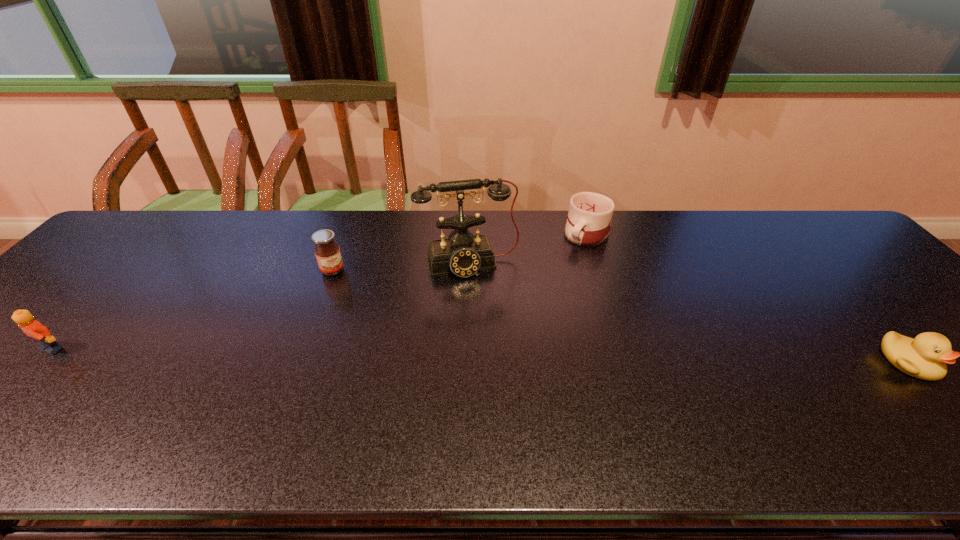
This screenshot has width=960, height=540. I want to click on free space on the desktop that is between the leftmost object and the duckling and is positioned on the dial of the tallest object, so [x=494, y=356].

At what (x,y) coordinates should I click in order to perform the action: click on free space on the desktop that is between the leftmost object and the rightmost object and is positioned on the label side of the jam. Please return your answer as a coordinate pair (x, y). The width and height of the screenshot is (960, 540). Looking at the image, I should click on (396, 354).

You are a GUI agent. You are given a task and a screenshot of the screen. Output one action in this format:
    pyautogui.click(x=<x>, y=<y>)
    Task: Click on the vacant space on the desktop that is between the Lego and the rightmost object and is positioned on the side with the handle of the mug
    This screenshot has height=540, width=960.
    Given the screenshot: What is the action you would take?
    pyautogui.click(x=452, y=355)